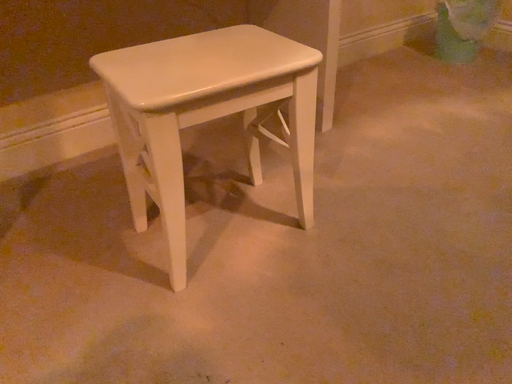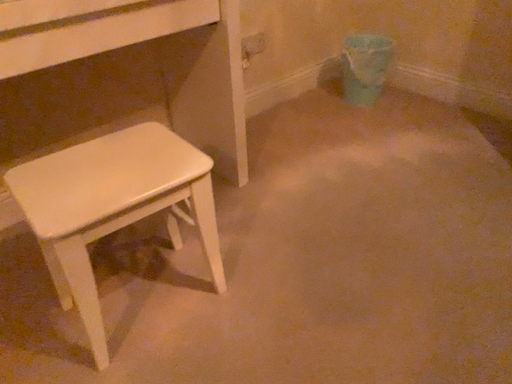
Question: Which way did the camera rotate in the video?

Choices:
 (A) rotated left
 (B) rotated right

Answer: (B)